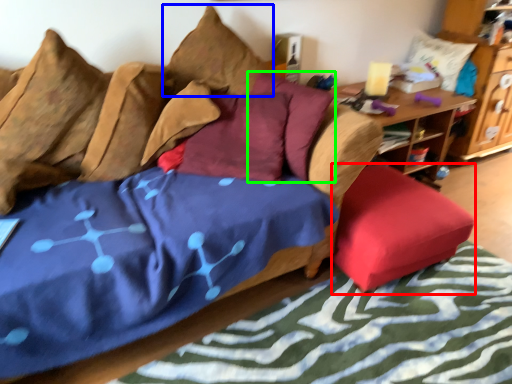
Question: Estimate the real-world distances between objects in this image. Which object is farther from chair (highlighted by a red box), pillow (highlighted by a blue box) or pillow (highlighted by a green box)?

Choices:
 (A) pillow
 (B) pillow

Answer: (A)